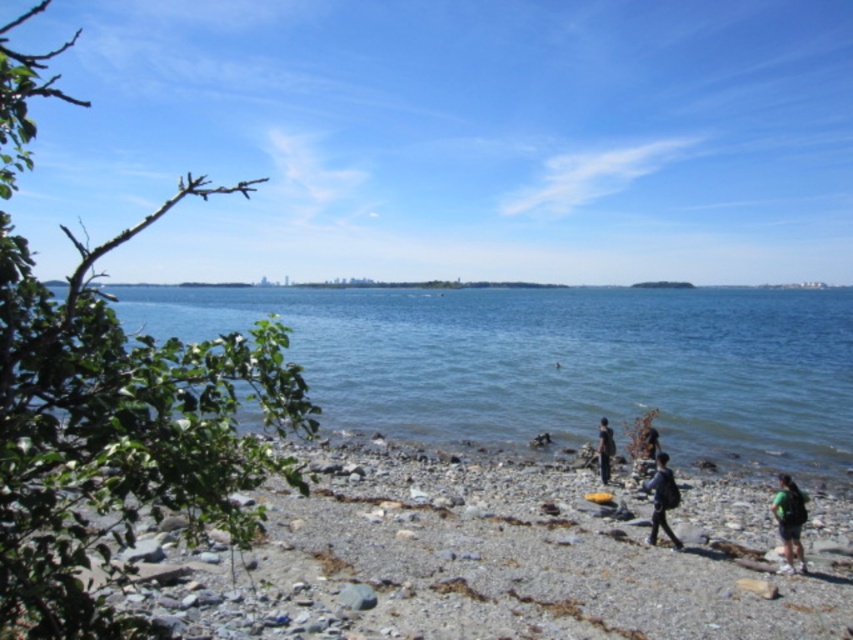
You are a hiker who wants to place your green fabric backpack at lower right on the ground near the smooth pebbles at center. Considering their sizes, will the backpack fit comfortably without overlapping the pebbles?

The smooth pebbles at center are larger in size compared to the green fabric backpack at lower right. Since the backpack is smaller, it can be placed between or around the larger pebbles without overlapping them.

You are a photographer trying to capture a closeup of the smooth pebbles at center while also including the dark gray backpack at lower right in the frame. Which object should you focus on first to ensure both are in focus?

The smooth pebbles at center has a lesser height compared to dark gray backpack at lower right, so you should focus on the dark gray backpack at lower right first since it is closer to the camera.

You are standing on the rocky shoreline and see two points marked in the image. Which point is closer to you, point [444,371] or point [611,449]?

Point [444,371] is closer to you than point [611,449] because it is further to the viewer.